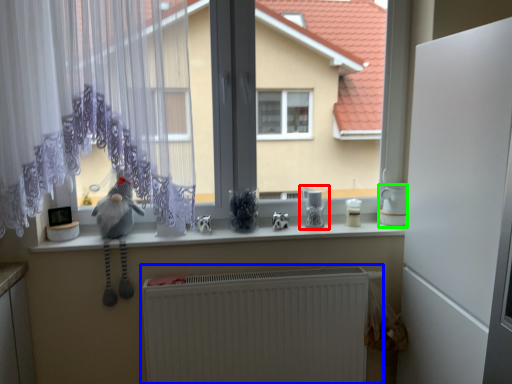
Question: Estimate the real-world distances between objects in this image. Which object is farther from appliance (highlighted by a red box), radiator (highlighted by a blue box) or appliance (highlighted by a green box)?

Choices:
 (A) radiator
 (B) appliance

Answer: (A)